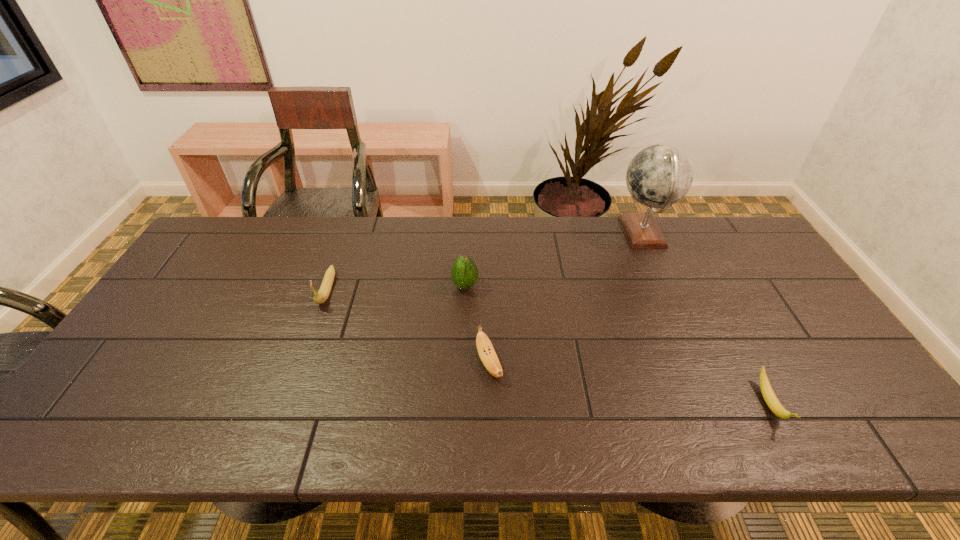
Locate an element on the screen. Image resolution: width=960 pixels, height=540 pixels. globe is located at coordinates (660, 175).

I want to click on the second object from right to left, so click(660, 175).

Image resolution: width=960 pixels, height=540 pixels. Identify the location of avocado. (464, 273).

In order to click on the leftmost banana in this screenshot , I will do `click(325, 288)`.

Find the location of a particular element. the third tallest object is located at coordinates (325, 288).

Find the location of `the second banana from left to right`. the second banana from left to right is located at coordinates (487, 354).

This screenshot has width=960, height=540. Identify the location of the rightmost object. (768, 394).

At what (x,y) coordinates should I click in order to perform the action: click on vacant point located 0.250m at the equator of the farthest object. Please return your answer as a coordinate pair (x, y). This screenshot has height=540, width=960. Looking at the image, I should click on 541,234.

Find the location of `free region located 0.280m at the equator of the farthest object`. free region located 0.280m at the equator of the farthest object is located at coordinates (532, 234).

I want to click on vacant space located at the equator of the farthest object, so click(x=588, y=234).